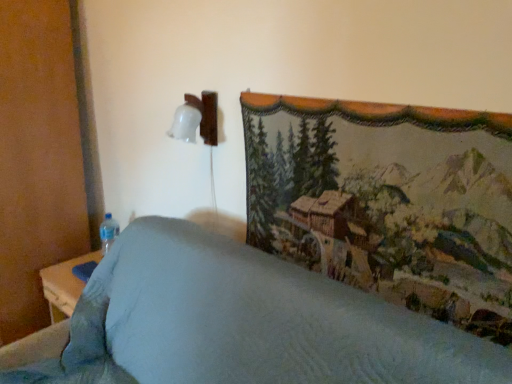
Question: Should I look upward or downward to see transparent plastic bottle at lower left?

Choices:
 (A) up
 (B) down

Answer: (B)

Question: Is the position of textured tapestry at upper right more distant than that of transparent plastic bottle at lower left?

Choices:
 (A) no
 (B) yes

Answer: (A)

Question: Is textured tapestry at upper right facing towards transparent plastic bottle at lower left?

Choices:
 (A) no
 (B) yes

Answer: (A)

Question: Is textured tapestry at upper right not inside transparent plastic bottle at lower left?

Choices:
 (A) no
 (B) yes

Answer: (B)

Question: Is textured tapestry at upper right at the right side of transparent plastic bottle at lower left?

Choices:
 (A) yes
 (B) no

Answer: (A)

Question: Considering the relative sizes of textured tapestry at upper right and transparent plastic bottle at lower left in the image provided, is textured tapestry at upper right thinner than transparent plastic bottle at lower left?

Choices:
 (A) yes
 (B) no

Answer: (A)

Question: From a real-world perspective, does textured tapestry at upper right sit lower than transparent plastic bottle at lower left?

Choices:
 (A) yes
 (B) no

Answer: (B)

Question: Can you confirm if textured tapestry at upper right is bigger than textured fabric bedspread at center?

Choices:
 (A) yes
 (B) no

Answer: (B)

Question: From a real-world perspective, is textured tapestry at upper right beneath textured fabric bedspread at center?

Choices:
 (A) no
 (B) yes

Answer: (A)

Question: Is the depth of textured tapestry at upper right greater than that of textured fabric bedspread at center?

Choices:
 (A) yes
 (B) no

Answer: (A)

Question: From a real-world perspective, is textured tapestry at upper right physically above textured fabric bedspread at center?

Choices:
 (A) yes
 (B) no

Answer: (A)

Question: Is textured tapestry at upper right oriented away from textured fabric bedspread at center?

Choices:
 (A) yes
 (B) no

Answer: (B)

Question: Can you confirm if textured tapestry at upper right is thinner than textured fabric bedspread at center?

Choices:
 (A) no
 (B) yes

Answer: (B)

Question: Is transparent plastic bottle at lower left taller than textured tapestry at upper right?

Choices:
 (A) yes
 (B) no

Answer: (B)